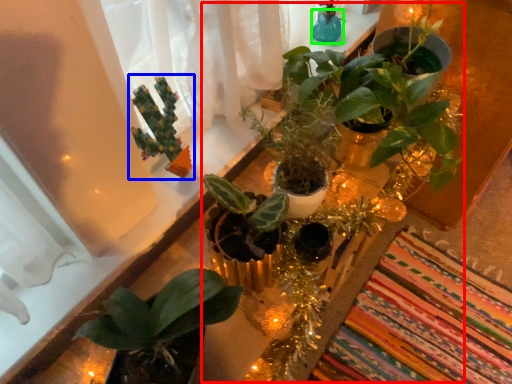
Question: Based on their relative distances, which object is nearer to floral arrangement (highlighted by a red box)? Choose from houseplant (highlighted by a blue box) and glass vase (highlighted by a green box).

Choices:
 (A) houseplant
 (B) glass vase

Answer: (A)